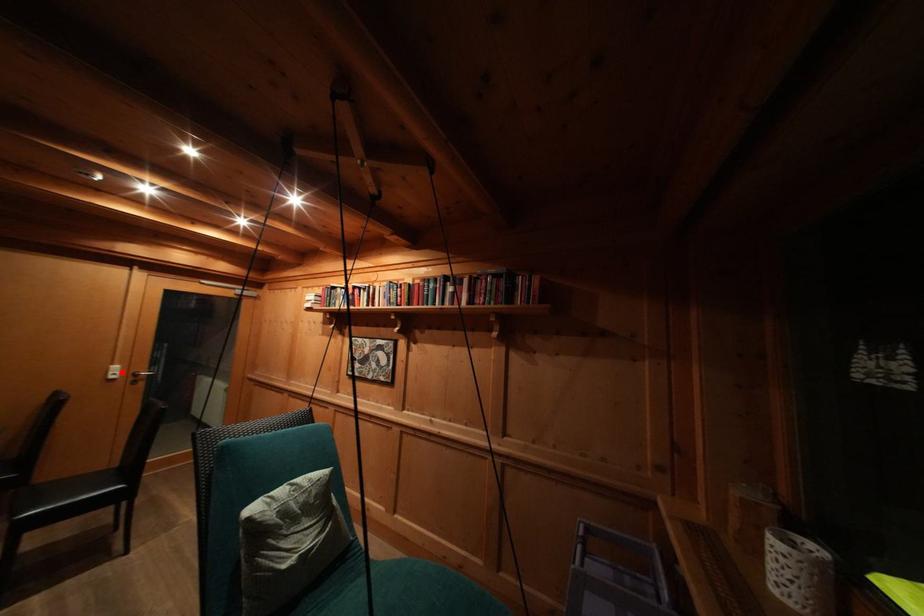
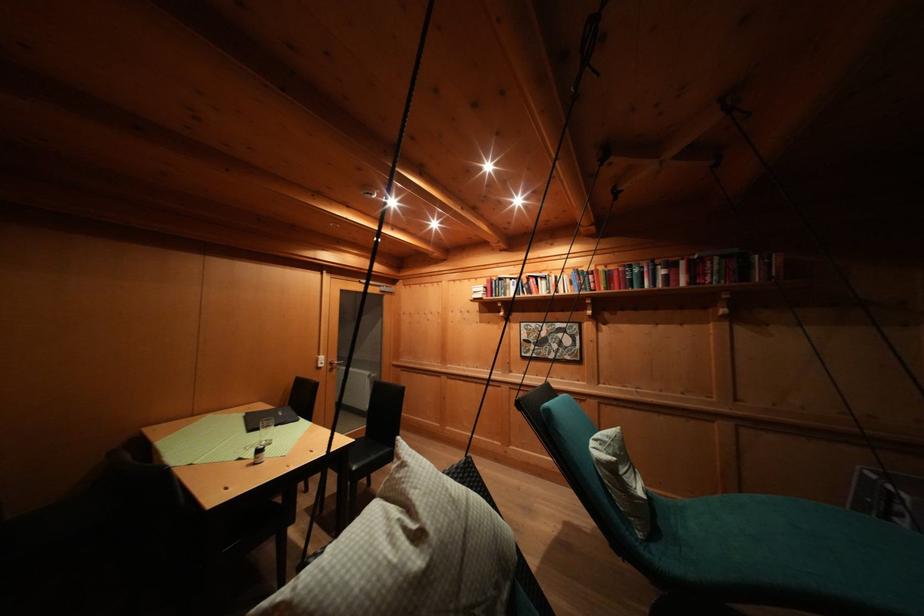
In the second image, find the point that corresponds to the highlighted location in the first image.

(327, 362)